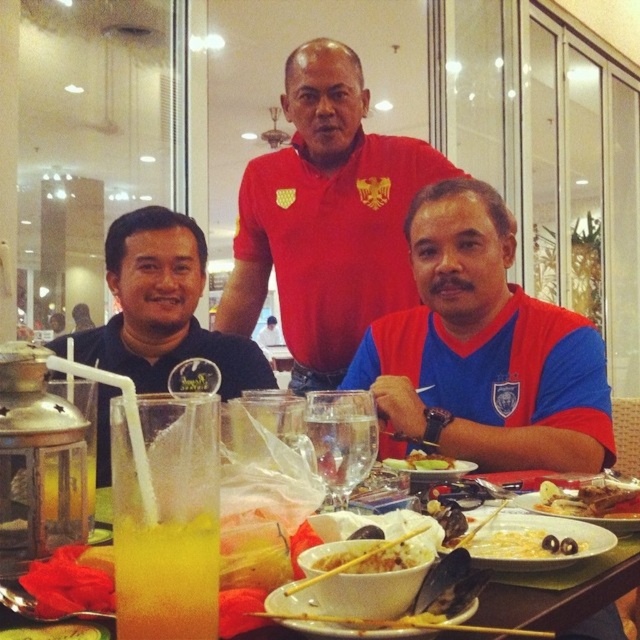
Question: Based on their relative distances, which object is nearer to the translucent glass beverage at lower left?

Choices:
 (A) black matte shirt at left
 (B) red matte shirt at center
 (C) yellow translucent noodles at center
 (D) translucent glass table at center

Answer: (C)

Question: Which point is closer to the camera taking this photo?

Choices:
 (A) (429, 253)
 (B) (317, 280)
 (C) (168, 580)

Answer: (C)

Question: Among these points, which one is farthest from the camera?

Choices:
 (A) (545, 540)
 (B) (358, 224)
 (C) (376, 556)
 (D) (346, 477)

Answer: (B)

Question: Is golden crispy chicken at lower right thinner than smooth white rice at center?

Choices:
 (A) yes
 (B) no

Answer: (B)

Question: Can you confirm if yellow translucent noodles at center is positioned to the left of yellowish matte rice at center?

Choices:
 (A) no
 (B) yes

Answer: (B)

Question: Can you confirm if translucent glass table at center is thinner than yellowish matte rice at center?

Choices:
 (A) no
 (B) yes

Answer: (A)